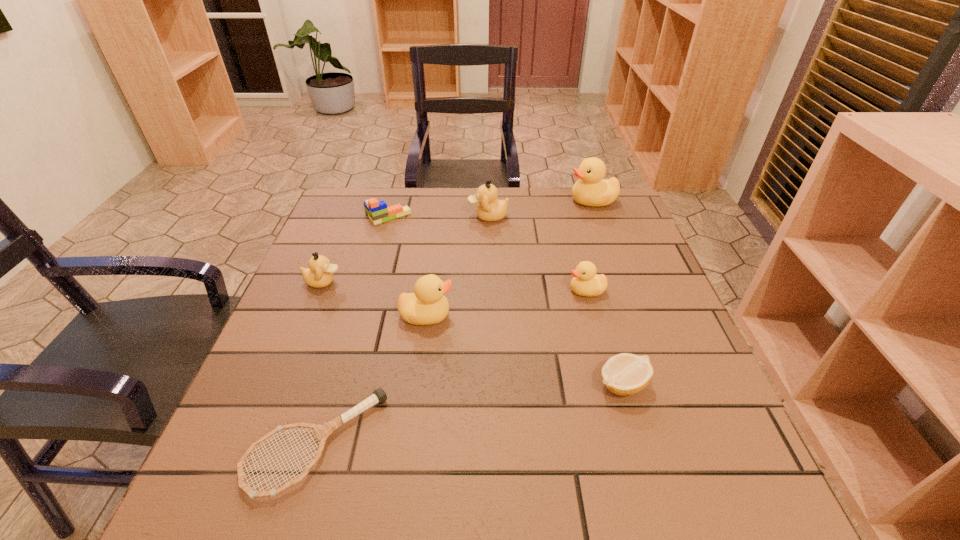
You are a GUI agent. You are given a task and a screenshot of the screen. Output one action in this format:
    pyautogui.click(x=<x>, y=<y>)
    Task: Click on the free space at the right edge of the desktop
    This screenshot has height=540, width=960.
    Given the screenshot: What is the action you would take?
    pyautogui.click(x=659, y=447)

At what (x,y) coordinates should I click in order to perform the action: click on vacant space at the far right corner. Please return your answer as a coordinate pair (x, y). The height and width of the screenshot is (540, 960). Looking at the image, I should click on [x=629, y=218].

Image resolution: width=960 pixels, height=540 pixels. Find the location of `free spot between the sixth tallest object and the third duckling from left to right`. free spot between the sixth tallest object and the third duckling from left to right is located at coordinates [438, 217].

The image size is (960, 540). In order to click on vacant space that is in between the nearest duckling and the tennis racket in this screenshot , I will do `click(372, 380)`.

Find the location of a particular element. This screenshot has height=540, width=960. vacant space in between the nearest duckling and the bigger tan duckling is located at coordinates (457, 266).

Image resolution: width=960 pixels, height=540 pixels. In order to click on free space that is in between the smallest yellow duckling and the leftmost yellow duckling in this screenshot , I will do `click(506, 303)`.

Where is `vacant area that lies between the sixth tallest object and the nearest duckling`? The height and width of the screenshot is (540, 960). vacant area that lies between the sixth tallest object and the nearest duckling is located at coordinates (407, 266).

You are a GUI agent. You are given a task and a screenshot of the screen. Output one action in this format:
    pyautogui.click(x=<x>, y=<y>)
    Task: Click on the vacant area between the biggest yellow duckling and the second smallest yellow duckling
    
    Given the screenshot: What is the action you would take?
    pyautogui.click(x=509, y=258)

Identify the location of empty location between the leftmost yellow duckling and the shortest object. (372, 380).

The width and height of the screenshot is (960, 540). I want to click on vacant space that is in between the Lego and the second biggest yellow duckling, so click(407, 266).